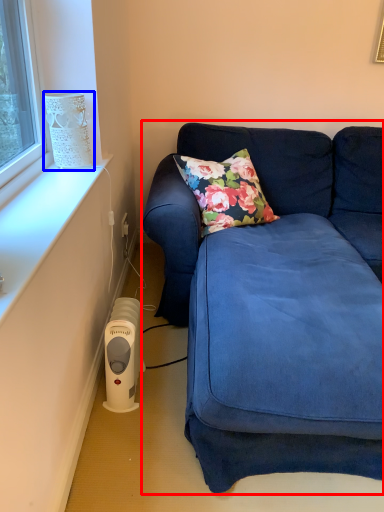
Question: Which of the following is the farthest to the observer, studio couch (highlighted by a red box) or lamp (highlighted by a blue box)?

Choices:
 (A) studio couch
 (B) lamp

Answer: (B)